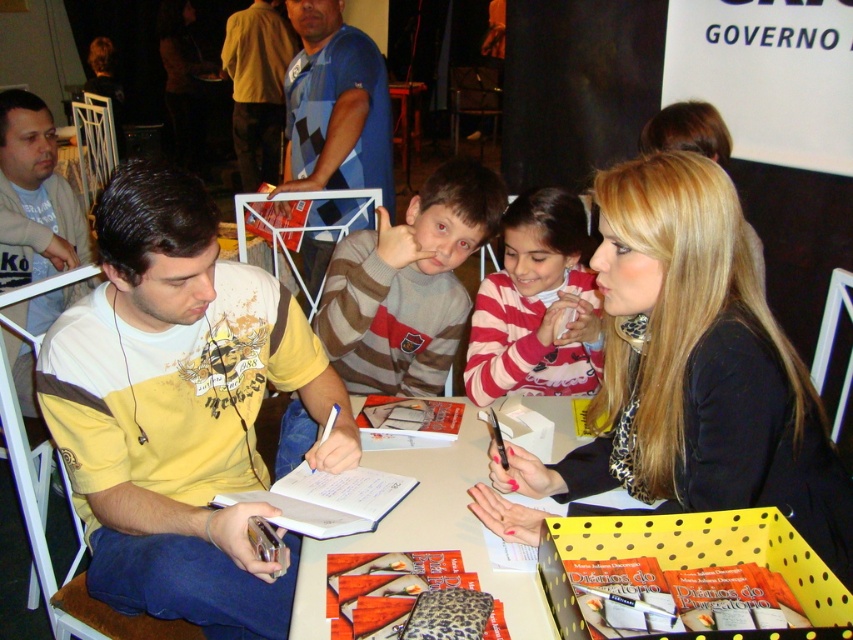
You are attending a book signing event and see the blue checkered shirt at upper center and the yellow polka dot cardboard box at center. Which object is closer to you?

The blue checkered shirt at upper center is closer to you because it is further to the viewer than the yellow polka dot cardboard box at center.

You are organizing a book signing event and need to place a decorative banner between the blue striped shirt at upper center and the yellow polka dot cardboard box at center. Which object should the banner be placed closer to to ensure it is centered between them?

The banner should be placed closer to the yellow polka dot cardboard box at center because the blue striped shirt at upper center is wider than the yellow polka dot cardboard box at center, so the center point would be shifted towards the narrower object.